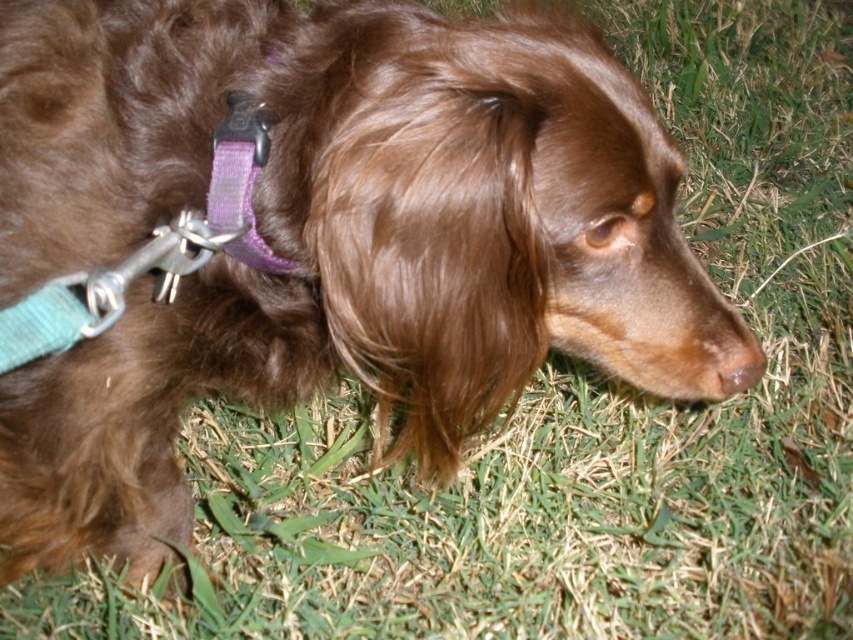
Question: Which point is farther to the camera?

Choices:
 (A) purple fabric collar at upper left
 (B) brown matte nose at lower center

Answer: (B)

Question: Does purple fabric collar at upper left have a lesser width compared to brown matte nose at lower center?

Choices:
 (A) yes
 (B) no

Answer: (B)

Question: Where is purple fabric collar at upper left located in relation to brown matte nose at lower center in the image?

Choices:
 (A) below
 (B) above

Answer: (B)

Question: Can you confirm if purple fabric collar at upper left is thinner than brown matte nose at lower center?

Choices:
 (A) yes
 (B) no

Answer: (B)